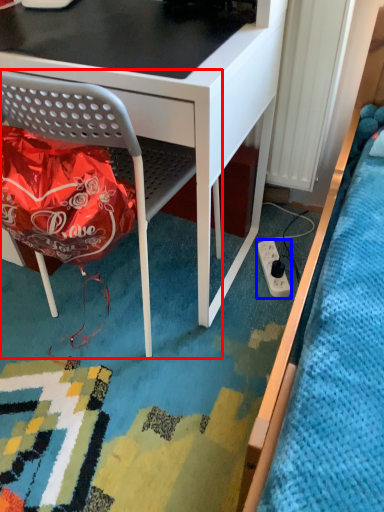
Question: Among these objects, which one is farthest to the camera, chair (highlighted by a red box) or power plugs and sockets (highlighted by a blue box)?

Choices:
 (A) chair
 (B) power plugs and sockets

Answer: (B)